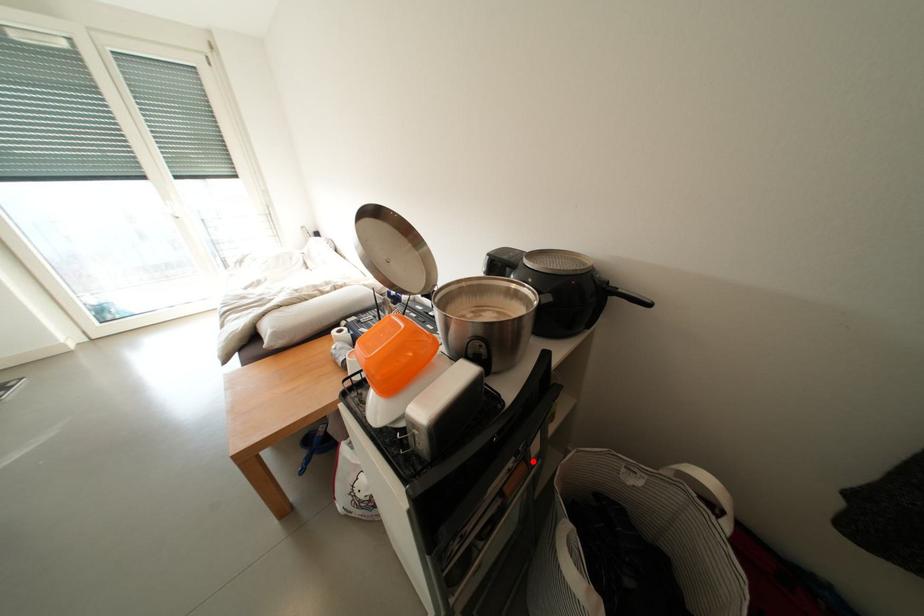
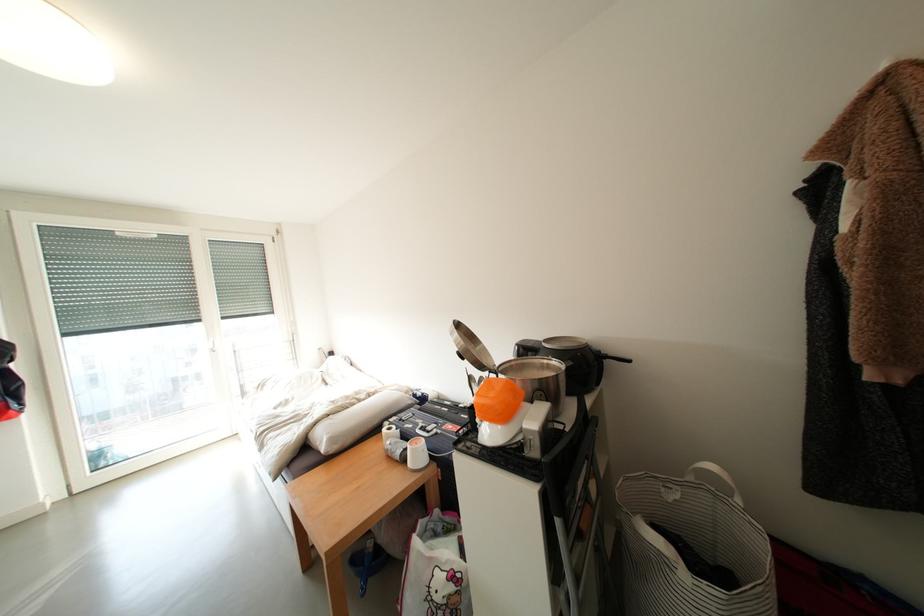
In the second image, find the point that corresponds to the highlighted location in the first image.

(594, 503)